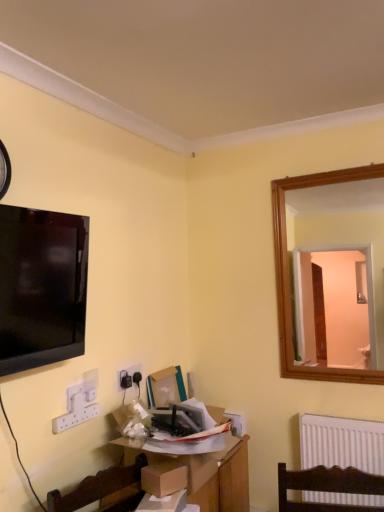
Question: Considering the positions of white plastic electric outlet at lower left and black plastic clock at upper left in the image, is white plastic electric outlet at lower left taller or shorter than black plastic clock at upper left?

Choices:
 (A) tall
 (B) short

Answer: (B)

Question: In the image, is white plastic electric outlet at lower left on the left side or the right side of black plastic clock at upper left?

Choices:
 (A) right
 (B) left

Answer: (A)

Question: Which is nearer to the cardboard box at center?

Choices:
 (A) wooden table at center
 (B) brown cardboard box at center
 (C) black plastic clock at upper left
 (D) matte black tv at upper left
 (E) white plastic electric outlet at lower left

Answer: (E)

Question: Estimate the real-world distances between objects in this image. Which object is closer to the black plastic clock at upper left?

Choices:
 (A) cardboard box at center
 (B) white plastic electric outlet at lower left
 (C) matte black tv at upper left
 (D) wooden table at center
 (E) brown cardboard box at center

Answer: (C)